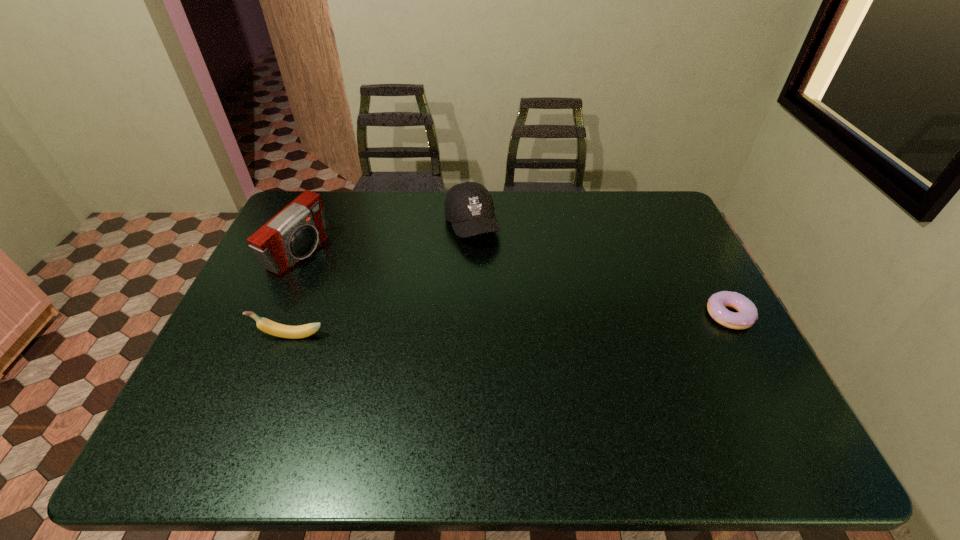
Where is `the second shortest object`? The width and height of the screenshot is (960, 540). the second shortest object is located at coordinates coord(268,326).

At what (x,y) coordinates should I click in order to perform the action: click on doughnut. Please return your answer as a coordinate pair (x, y). The image size is (960, 540). Looking at the image, I should click on (747, 314).

At what (x,y) coordinates should I click in order to perform the action: click on the shortest object. Please return your answer as a coordinate pair (x, y). Looking at the image, I should click on (747, 314).

You are a GUI agent. You are given a task and a screenshot of the screen. Output one action in this format:
    pyautogui.click(x=<x>, y=<y>)
    Task: Click on the baseball cap
    The height and width of the screenshot is (540, 960).
    Given the screenshot: What is the action you would take?
    pyautogui.click(x=469, y=207)

Where is `the third shortest object`? Image resolution: width=960 pixels, height=540 pixels. the third shortest object is located at coordinates (469, 207).

Where is `camera`? The height and width of the screenshot is (540, 960). camera is located at coordinates (293, 234).

You are a GUI agent. You are given a task and a screenshot of the screen. Output one action in this format:
    pyautogui.click(x=<x>, y=<y>)
    Task: Click on the free space located 0.090m at the stem of the banana
    The width and height of the screenshot is (960, 540).
    Given the screenshot: What is the action you would take?
    pyautogui.click(x=220, y=335)

I want to click on vacant space positioned on the back of the doughnut, so click(699, 259).

This screenshot has height=540, width=960. In order to click on vacant space situated 0.180m on the front-facing side of the third shortest object in this screenshot , I will do `click(496, 289)`.

Identify the location of vacant space located 0.050m on the front-facing side of the third shortest object. Image resolution: width=960 pixels, height=540 pixels. (484, 260).